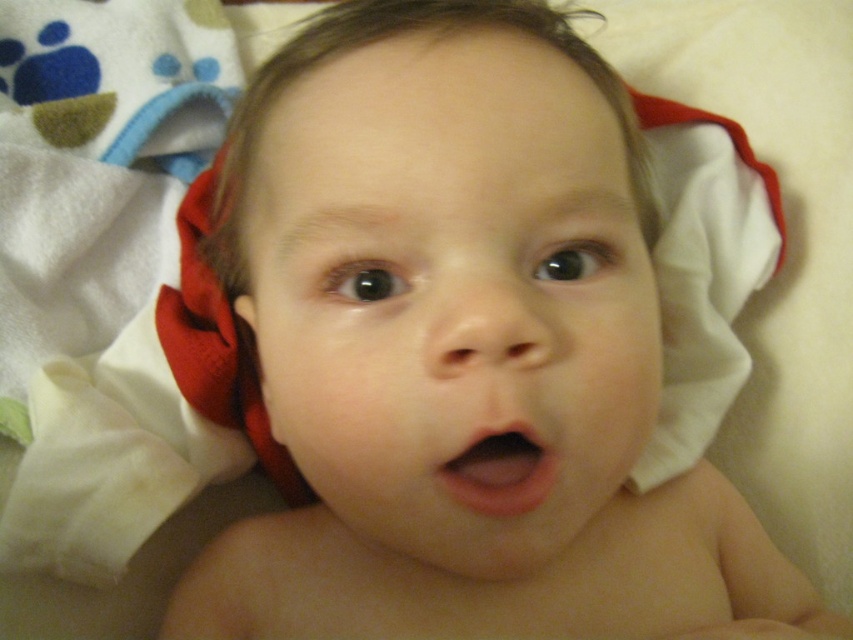
You are a photographer trying to capture the baby in the image. You want to ensure the pink smooth flesh at center and the soft fabric ear at lower left are both in focus. If your camera has a depth of field that can cover 8 inches, will both objects be in focus?

The pink smooth flesh at center is 7.89 inches away from the soft fabric ear at lower left. Since the distance between them is less than the camera depth of field of 8 inches, both objects will be in focus.

You are a photographer adjusting the lighting for a baby photo shoot. You notice the pink smooth flesh at center and the soft fabric ear at lower left in the frame. Which object is positioned to the right side of the other?

The pink smooth flesh at center is to the right of the soft fabric ear at lower left.